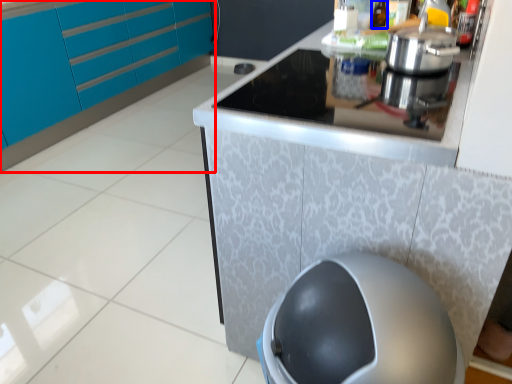
Question: Among these objects, which one is nearest to the camera, cabinetry (highlighted by a red box) or bottle (highlighted by a blue box)?

Choices:
 (A) cabinetry
 (B) bottle

Answer: (B)